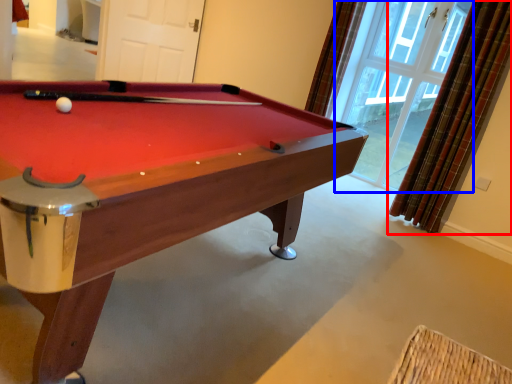
Question: Which object is closer to the camera taking this photo, curtain (highlighted by a red box) or window (highlighted by a blue box)?

Choices:
 (A) curtain
 (B) window

Answer: (A)